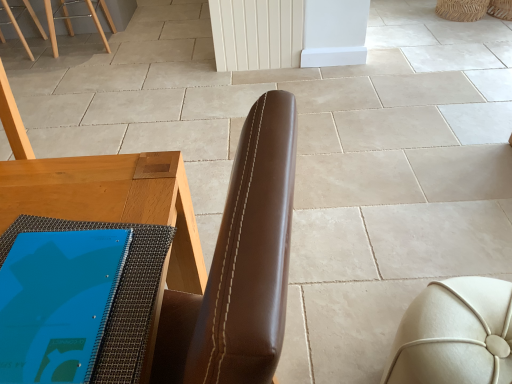
Where is `empty space that is ontop of white leather ottoman at lower right (from a real-world perspective)`? empty space that is ontop of white leather ottoman at lower right (from a real-world perspective) is located at coordinates (467, 320).